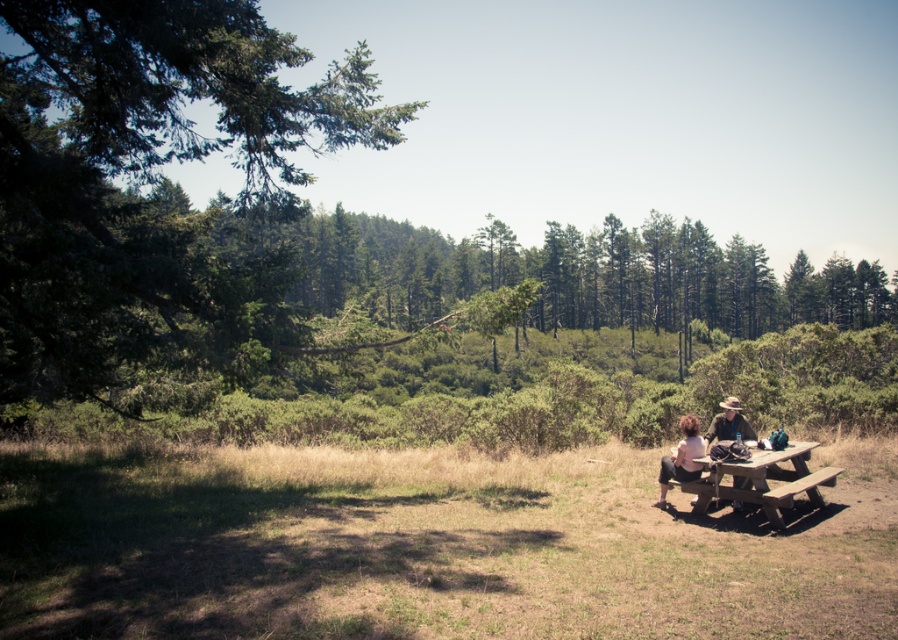
You are a photographer trying to capture a clear shot of both the brown leather hat at center and the light brown hair at lower right. Since you want to avoid any obstructions, which object should you focus on first to ensure it doesn

The light brown hair at lower right is taller than the brown leather hat at center, so you should focus on capturing the taller light brown hair at lower right first to avoid it blocking the shorter hat.

You are standing at the edge of a grassy slope and see the wooden picnic table at lower right. If you want to walk straight towards it, will you need to climb uphill or downhill?

The wooden picnic table at lower right is 7.71 meters from the viewer. Since the ground is described as slightly sloped, but the exact direction of the slope relative to the table isn

You are standing at the edge of the grassy area and want to walk towards the wooden picnic table at lower right and the light brown hair at lower right. Which one will you see first as you approach?

You will see the light brown hair at lower right first because it is positioned to the left of the wooden picnic table at lower right, making it closer to your line of sight as you approach from the edge of the grassy area.